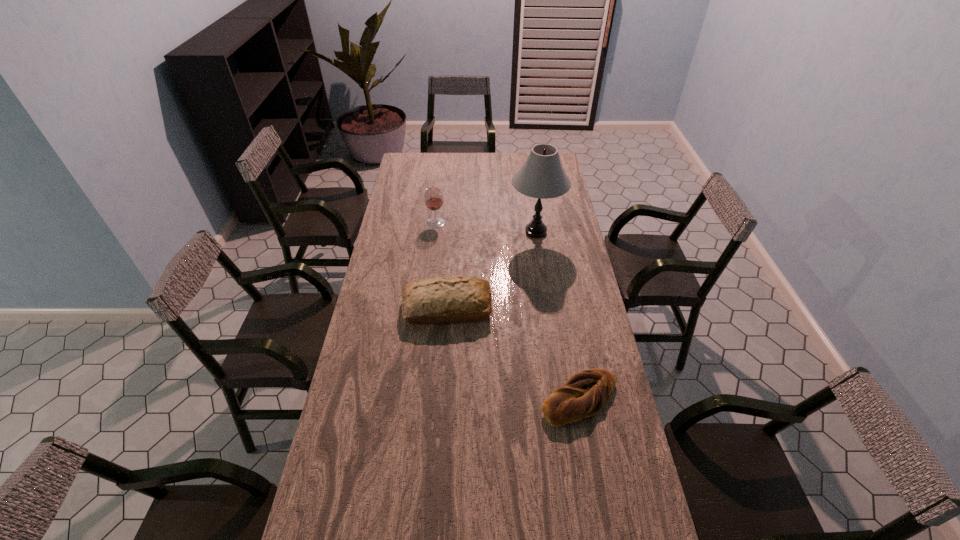
At what (x,y) coordinates should I click in order to perform the action: click on unoccupied area between the nearer bread and the tallest object. Please return your answer as a coordinate pair (x, y). Looking at the image, I should click on (558, 315).

At what (x,y) coordinates should I click in order to perform the action: click on vacant region between the second tallest object and the lamp. Please return your answer as a coordinate pair (x, y). Image resolution: width=960 pixels, height=540 pixels. Looking at the image, I should click on (486, 227).

Where is `free space between the wineglass and the nearest object`? free space between the wineglass and the nearest object is located at coordinates (508, 310).

You are a GUI agent. You are given a task and a screenshot of the screen. Output one action in this format:
    pyautogui.click(x=<x>, y=<y>)
    Task: Click on the free spot between the lamp and the taller bread
    The height and width of the screenshot is (540, 960).
    Given the screenshot: What is the action you would take?
    pyautogui.click(x=492, y=270)

At what (x,y) coordinates should I click in order to perform the action: click on the third closest object to the lamp. Please return your answer as a coordinate pair (x, y). Looking at the image, I should click on (585, 393).

Find the location of a particular element. object that is the second closest one to the tallest object is located at coordinates (433, 197).

Where is `vacant position in the image that satisfies the following two spatial constraints: 1. on the front side of the second nearest object; 2. on the left side of the shortest object`? vacant position in the image that satisfies the following two spatial constraints: 1. on the front side of the second nearest object; 2. on the left side of the shortest object is located at coordinates (441, 399).

Locate an element on the screen. This screenshot has width=960, height=540. free spot that satisfies the following two spatial constraints: 1. on the front side of the wineglass; 2. on the left side of the third farthest object is located at coordinates pyautogui.click(x=426, y=308).